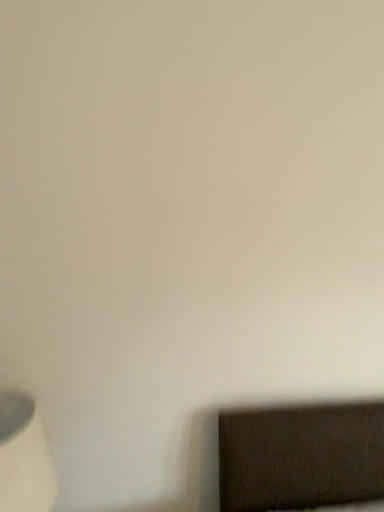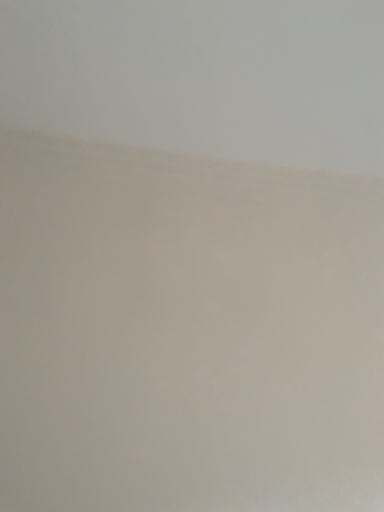
Question: Which way did the camera rotate in the video?

Choices:
 (A) rotated left
 (B) rotated right

Answer: (B)